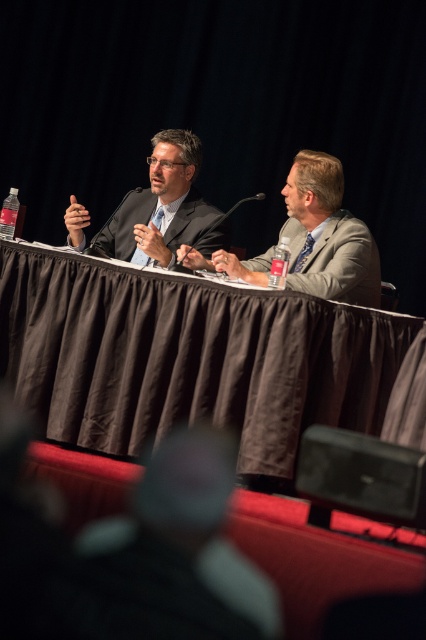
The height and width of the screenshot is (640, 426). Describe the element at coordinates (187, 356) in the screenshot. I see `brown fabric table at center` at that location.

Is brown fabric table at center above black plastic speaker at lower right?

Yes, brown fabric table at center is above black plastic speaker at lower right.

Which is in front, point (227, 356) or point (340, 456)?

Point (340, 456) is more forward.

The height and width of the screenshot is (640, 426). Find the location of `brown fabric table at center`. brown fabric table at center is located at coordinates (187, 356).

You are a GUI agent. You are given a task and a screenshot of the screen. Output one action in this format:
    pyautogui.click(x=<x>, y=<y>)
    Task: Click on the brown fabric table at center
    Image resolution: width=426 pixels, height=640 pixels.
    Given the screenshot: What is the action you would take?
    pyautogui.click(x=187, y=356)

Which is below, brown fabric table at center or black plastic microphone at center?

brown fabric table at center is lower down.

Who is more forward, [356,372] or [249,198]?

Point [356,372] is in front.

Locate an element on the screen. This screenshot has width=426, height=640. brown fabric table at center is located at coordinates (187, 356).

Can you confirm if black plastic speaker at lower right is positioned below matte black microphone at center?

Correct, black plastic speaker at lower right is located below matte black microphone at center.

What are the coordinates of `black plastic speaker at lower right` in the screenshot? It's located at (360, 477).

Is point (402, 461) positioned in front of point (91, 244)?

Yes, point (402, 461) is closer to viewer.

This screenshot has width=426, height=640. I want to click on black plastic speaker at lower right, so click(x=360, y=477).